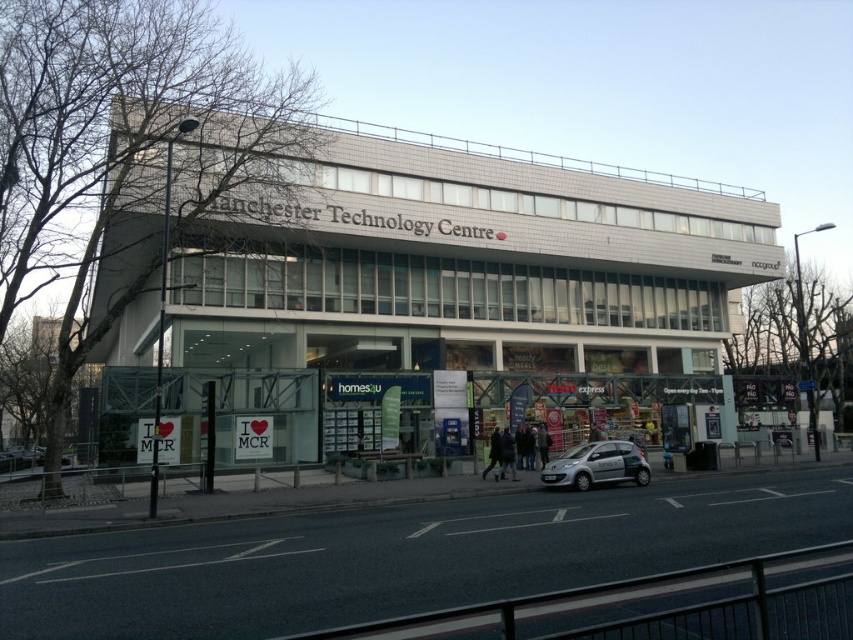
Question: Which object appears farthest from the camera in this image?

Choices:
 (A) silver metallic car at center
 (B) white glass building at center

Answer: (A)

Question: Which object appears closest to the camera in this image?

Choices:
 (A) white glass building at center
 (B) silver metallic car at center

Answer: (A)

Question: Can you confirm if white glass building at center is wider than silver metallic car at center?

Choices:
 (A) yes
 (B) no

Answer: (A)

Question: Where is white glass building at center located in relation to silver metallic car at center in the image?

Choices:
 (A) right
 (B) left

Answer: (B)

Question: In this image, where is white glass building at center located relative to silver metallic car at center?

Choices:
 (A) below
 (B) above

Answer: (B)